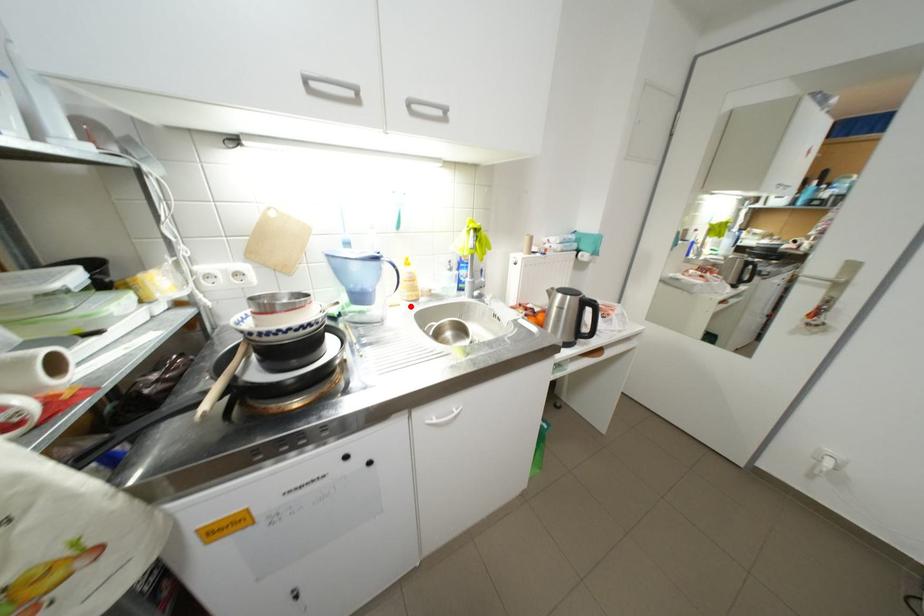
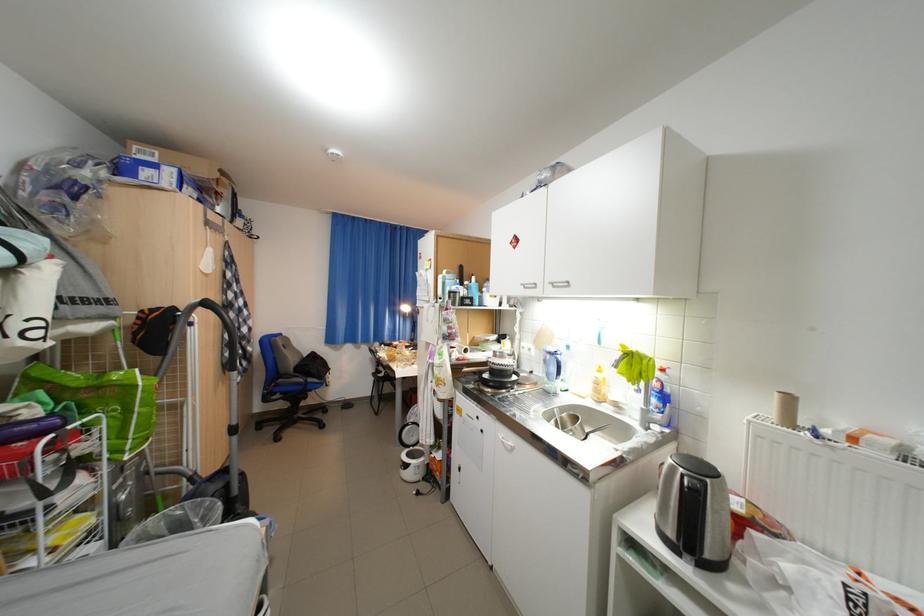
Question: I am providing you with two images of the same scene from different viewpoints. In image1, a red point is highlighted. Considering the same 3D point in image2, which of the following is correct?

Choices:
 (A) It is closer
 (B) It is farther

Answer: (B)